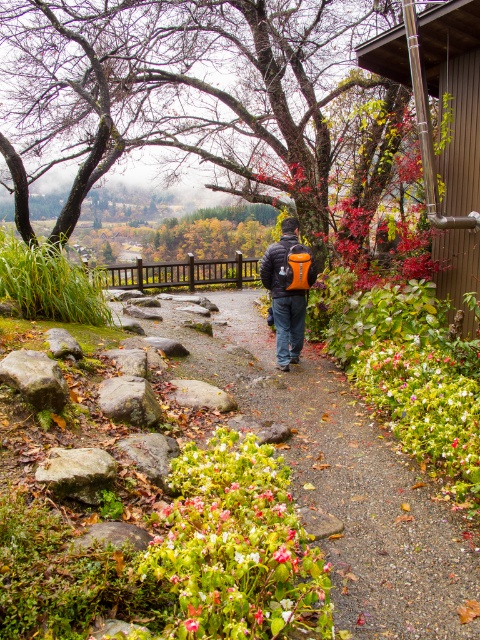
Question: Which is farther from the gravel path at center?

Choices:
 (A) green leafy plant at center
 (B) orange matte jacket at center
 (C) orange fabric backpack at center

Answer: (B)

Question: Which point is closer to the camera taking this photo?

Choices:
 (A) (287, 237)
 (B) (296, 342)

Answer: (A)

Question: Can you confirm if gravel path at center is positioned below orange matte jacket at center?

Choices:
 (A) yes
 (B) no

Answer: (A)

Question: Can you confirm if orange fabric backpack at center is wider than orange matte jacket at center?

Choices:
 (A) yes
 (B) no

Answer: (A)

Question: Which point is farther to the camera?

Choices:
 (A) green leafy plant at center
 (B) orange fabric backpack at center

Answer: (B)

Question: Is orange fabric backpack at center further to the viewer compared to orange matte jacket at center?

Choices:
 (A) no
 (B) yes

Answer: (A)